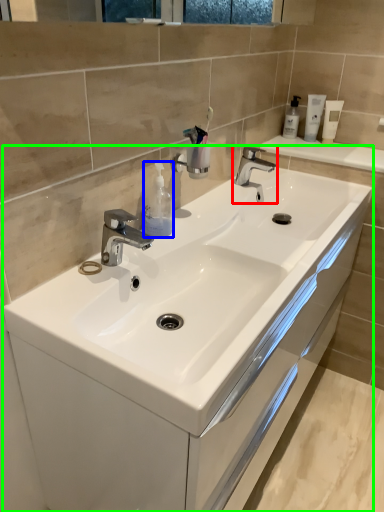
Question: Considering the real-world distances, which object is closest to tap (highlighted by a red box)? soap dispenser (highlighted by a blue box) or bathroom cabinet (highlighted by a green box).

Choices:
 (A) soap dispenser
 (B) bathroom cabinet

Answer: (A)